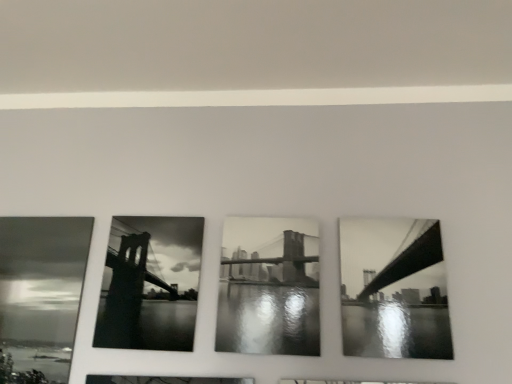
Find the location of a particular element. The height and width of the screenshot is (384, 512). black glossy photo frame at center, placed as the 3th picture frame when sorted from right to left is located at coordinates (150, 283).

What do you see at coordinates (394, 289) in the screenshot? Image resolution: width=512 pixels, height=384 pixels. I see `black glossy bridge at right, which is the third picture frame in left-to-right order` at bounding box center [394, 289].

Identify the location of black glossy photo frame at center, placed as the 3th picture frame when sorted from right to left. This screenshot has width=512, height=384. (150, 283).

Which of these two, black glossy photo frame at center, arranged as the 1th picture frame when viewed from the left, or black and white photograph of bridge at center, which appears as the second picture frame when viewed from the left, is wider?

black and white photograph of bridge at center, which appears as the second picture frame when viewed from the left, is wider.

Considering the relative positions of black glossy photo frame at center, arranged as the 1th picture frame when viewed from the left, and black and white photograph of bridge at center, which appears as the second picture frame when viewed from the left, in the image provided, is black glossy photo frame at center, arranged as the 1th picture frame when viewed from the left, in front of black and white photograph of bridge at center, which appears as the second picture frame when viewed from the left,?

No, it is not.

How many degrees apart are the facing directions of black glossy photo frame at center, placed as the 3th picture frame when sorted from right to left, and black and white photograph of bridge at center, which appears as the second picture frame when viewed from the left?

0 degrees.

From the picture: Which of these two, black glossy photo frame at center, placed as the 3th picture frame when sorted from right to left, or black and white photograph of bridge at center, which appears as the second picture frame when viewed from the left, stands taller?

black glossy photo frame at center, placed as the 3th picture frame when sorted from right to left, is taller.

Is black glossy bridge at right, positioned as the 1th picture frame in right-to-left order, positioned beyond the bounds of black glossy photo frame at center, arranged as the 1th picture frame when viewed from the left?

Yes, black glossy bridge at right, positioned as the 1th picture frame in right-to-left order, is not within black glossy photo frame at center, arranged as the 1th picture frame when viewed from the left.

Which object is wider, black glossy bridge at right, which is the third picture frame in left-to-right order, or black glossy photo frame at center, arranged as the 1th picture frame when viewed from the left?

black glossy bridge at right, which is the third picture frame in left-to-right order, is wider.

Find the location of `picture frame that is the 2nd object located behind the black glossy bridge at right, positioned as the 1th picture frame in right-to-left order`. picture frame that is the 2nd object located behind the black glossy bridge at right, positioned as the 1th picture frame in right-to-left order is located at coordinates (150, 283).

Which is behind, black glossy bridge at right, which is the third picture frame in left-to-right order, or black glossy photo frame at center, arranged as the 1th picture frame when viewed from the left?

black glossy photo frame at center, arranged as the 1th picture frame when viewed from the left, is more distant.

Based on the photo, from the image's perspective, is black and white photograph of bridge at center, which appears as the second picture frame when viewed from the left, positioned above or below black glossy photo frame at center, placed as the 3th picture frame when sorted from right to left?

Based on their image positions, black and white photograph of bridge at center, which appears as the second picture frame when viewed from the left, is located above black glossy photo frame at center, placed as the 3th picture frame when sorted from right to left.

Find the location of a particular element. The image size is (512, 384). picture frame behind the black and white photograph of bridge at center, which appears as the second picture frame when viewed from the left is located at coordinates (150, 283).

Based on the photo, can black glossy photo frame at center, arranged as the 1th picture frame when viewed from the left, be found inside black and white photograph of bridge at center, which appears as the second picture frame when viewed from the left?

That's incorrect, black glossy photo frame at center, arranged as the 1th picture frame when viewed from the left, is not inside black and white photograph of bridge at center, which appears as the second picture frame when viewed from the left.

Would you say black and white photograph of bridge at center, placed as the second picture frame when sorted from right to left, is inside or outside black glossy bridge at right, which is the third picture frame in left-to-right order?

black and white photograph of bridge at center, placed as the second picture frame when sorted from right to left, exists outside the volume of black glossy bridge at right, which is the third picture frame in left-to-right order.

Is black and white photograph of bridge at center, which appears as the second picture frame when viewed from the left, thinner than black glossy bridge at right, which is the third picture frame in left-to-right order?

Yes, black and white photograph of bridge at center, which appears as the second picture frame when viewed from the left, is thinner than black glossy bridge at right, which is the third picture frame in left-to-right order.

Looking at the image, does black and white photograph of bridge at center, placed as the second picture frame when sorted from right to left, seem bigger or smaller compared to black glossy bridge at right, which is the third picture frame in left-to-right order?

In the image, black and white photograph of bridge at center, placed as the second picture frame when sorted from right to left, appears to be larger than black glossy bridge at right, which is the third picture frame in left-to-right order.

Is black glossy photo frame at center, arranged as the 1th picture frame when viewed from the left, not close to black glossy bridge at right, which is the third picture frame in left-to-right order?

That's not correct — black glossy photo frame at center, arranged as the 1th picture frame when viewed from the left, is a little close to black glossy bridge at right, which is the third picture frame in left-to-right order.

What's the angular difference between black glossy photo frame at center, placed as the 3th picture frame when sorted from right to left, and black glossy bridge at right, positioned as the 1th picture frame in right-to-left order,'s facing directions?

The angular difference between black glossy photo frame at center, placed as the 3th picture frame when sorted from right to left, and black glossy bridge at right, positioned as the 1th picture frame in right-to-left order, is 0.00433 degrees.

Is black glossy photo frame at center, arranged as the 1th picture frame when viewed from the left, positioned behind black glossy bridge at right, which is the third picture frame in left-to-right order?

Yes, it is behind black glossy bridge at right, which is the third picture frame in left-to-right order.

Is black glossy photo frame at center, arranged as the 1th picture frame when viewed from the left, taller than black glossy bridge at right, positioned as the 1th picture frame in right-to-left order?

Indeed, black glossy photo frame at center, arranged as the 1th picture frame when viewed from the left, has a greater height compared to black glossy bridge at right, positioned as the 1th picture frame in right-to-left order.

Which object is more forward, black glossy bridge at right, positioned as the 1th picture frame in right-to-left order, or black and white photograph of bridge at center, which appears as the second picture frame when viewed from the left?

black glossy bridge at right, positioned as the 1th picture frame in right-to-left order, is closer to the camera.

Is black glossy bridge at right, positioned as the 1th picture frame in right-to-left order, positioned far away from black and white photograph of bridge at center, which appears as the second picture frame when viewed from the left?

black glossy bridge at right, positioned as the 1th picture frame in right-to-left order, is near black and white photograph of bridge at center, which appears as the second picture frame when viewed from the left, not far away.

From a real-world perspective, who is located lower, black glossy bridge at right, which is the third picture frame in left-to-right order, or black and white photograph of bridge at center, placed as the second picture frame when sorted from right to left?

black and white photograph of bridge at center, placed as the second picture frame when sorted from right to left, from a real-world perspective.

Does black glossy bridge at right, which is the third picture frame in left-to-right order, appear on the right side of black and white photograph of bridge at center, which appears as the second picture frame when viewed from the left?

Yes, black glossy bridge at right, which is the third picture frame in left-to-right order, is to the right of black and white photograph of bridge at center, which appears as the second picture frame when viewed from the left.

The image size is (512, 384). Find the location of `the 1st picture frame to the right of the black glossy photo frame at center, placed as the 3th picture frame when sorted from right to left, counting from the anchor's position`. the 1st picture frame to the right of the black glossy photo frame at center, placed as the 3th picture frame when sorted from right to left, counting from the anchor's position is located at coordinates (269, 287).

Locate an element on the screen. The image size is (512, 384). picture frame that is the 2nd object located below the black glossy bridge at right, positioned as the 1th picture frame in right-to-left order (from the image's perspective) is located at coordinates (150, 283).

In the scene shown: Considering their positions, is black and white photograph of bridge at center, placed as the second picture frame when sorted from right to left, positioned closer to black glossy bridge at right, positioned as the 1th picture frame in right-to-left order, than black glossy photo frame at center, arranged as the 1th picture frame when viewed from the left?

black and white photograph of bridge at center, placed as the second picture frame when sorted from right to left, lies closer to black glossy bridge at right, positioned as the 1th picture frame in right-to-left order, than the other object.

When comparing their distances from black and white photograph of bridge at center, placed as the second picture frame when sorted from right to left, does black glossy bridge at right, which is the third picture frame in left-to-right order, or black glossy photo frame at center, arranged as the 1th picture frame when viewed from the left, seem further?

black glossy bridge at right, which is the third picture frame in left-to-right order, lies further to black and white photograph of bridge at center, placed as the second picture frame when sorted from right to left, than the other object.

Estimate the real-world distances between objects in this image. Which object is closer to black glossy photo frame at center, arranged as the 1th picture frame when viewed from the left, black glossy bridge at right, positioned as the 1th picture frame in right-to-left order, or black and white photograph of bridge at center, placed as the second picture frame when sorted from right to left?

black and white photograph of bridge at center, placed as the second picture frame when sorted from right to left, lies closer to black glossy photo frame at center, arranged as the 1th picture frame when viewed from the left, than the other object.

Which object lies further to the anchor point black glossy bridge at right, which is the third picture frame in left-to-right order, black glossy photo frame at center, placed as the 3th picture frame when sorted from right to left, or black and white photograph of bridge at center, which appears as the second picture frame when viewed from the left?

The object further to black glossy bridge at right, which is the third picture frame in left-to-right order, is black glossy photo frame at center, placed as the 3th picture frame when sorted from right to left.

Estimate the real-world distances between objects in this image. Which object is closer to black and white photograph of bridge at center, placed as the second picture frame when sorted from right to left, black glossy photo frame at center, placed as the 3th picture frame when sorted from right to left, or black glossy bridge at right, positioned as the 1th picture frame in right-to-left order?

Among the two, black glossy photo frame at center, placed as the 3th picture frame when sorted from right to left, is located nearer to black and white photograph of bridge at center, placed as the second picture frame when sorted from right to left.

Looking at the image, which one is located closer to black glossy photo frame at center, arranged as the 1th picture frame when viewed from the left, black and white photograph of bridge at center, placed as the second picture frame when sorted from right to left, or black glossy bridge at right, positioned as the 1th picture frame in right-to-left order?

Based on the image, black and white photograph of bridge at center, placed as the second picture frame when sorted from right to left, appears to be nearer to black glossy photo frame at center, arranged as the 1th picture frame when viewed from the left.

Locate an element on the screen. The height and width of the screenshot is (384, 512). picture frame situated between black glossy photo frame at center, arranged as the 1th picture frame when viewed from the left, and black glossy bridge at right, positioned as the 1th picture frame in right-to-left order, from left to right is located at coordinates (269, 287).